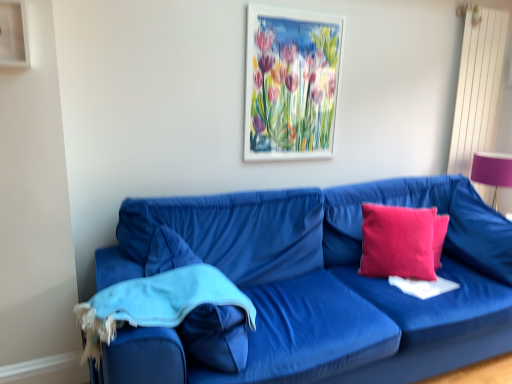
Describe the element at coordinates (423, 286) in the screenshot. This screenshot has height=384, width=512. I see `white fabric at center` at that location.

The height and width of the screenshot is (384, 512). In order to click on velvet blue couch at lower left in this screenshot , I will do `click(358, 304)`.

At what (x,y) coordinates should I click in order to perform the action: click on pink fabric pillow at right, placed as the 1th pillow when sorted from right to left. Please return your answer as a coordinate pair (x, y). Looking at the image, I should click on (478, 232).

The image size is (512, 384). I want to click on blue cotton blanket at lower left, so click(156, 303).

Describe the element at coordinates (291, 83) in the screenshot. I see `white matte picture frame at upper center` at that location.

In order to click on white fabric at center in this screenshot , I will do `click(423, 286)`.

Looking at this image, what's the angular difference between velvet blue couch at lower left and pink velvet pillow at right, which ranks as the first pillow in left-to-right order,'s facing directions?

They differ by 27.7 degrees in their facing directions.

Between velvet blue couch at lower left and pink velvet pillow at right, which ranks as the first pillow in left-to-right order, which one has smaller size?

pink velvet pillow at right, which ranks as the first pillow in left-to-right order, is smaller.

Which is in front, point (276, 375) or point (420, 220)?

The point (276, 375) is closer.

From the picture: Is velvet blue couch at lower left surrounding pink velvet pillow at right, marked as the second pillow in a right-to-left arrangement?

Yes, pink velvet pillow at right, marked as the second pillow in a right-to-left arrangement, is surrounded by velvet blue couch at lower left.

Which is in front, blue cotton blanket at lower left or pink velvet pillow at right, which ranks as the first pillow in left-to-right order?

blue cotton blanket at lower left is closer to the camera.

From a real-world perspective, is blue cotton blanket at lower left positioned above or below pink velvet pillow at right, which ranks as the first pillow in left-to-right order?

Clearly, from a real-world perspective, blue cotton blanket at lower left is below pink velvet pillow at right, which ranks as the first pillow in left-to-right order.

Find the location of a particular element. This screenshot has height=384, width=512. material on the left of pink velvet pillow at right, marked as the second pillow in a right-to-left arrangement is located at coordinates (156, 303).

Which of these two, blue cotton blanket at lower left or pink velvet pillow at right, which ranks as the first pillow in left-to-right order, stands taller?

pink velvet pillow at right, which ranks as the first pillow in left-to-right order, is taller.

Would you consider blue cotton blanket at lower left to be distant from white matte picture frame at upper center?

blue cotton blanket at lower left is positioned a significant distance from white matte picture frame at upper center.

From the picture: Can you confirm if blue cotton blanket at lower left is smaller than white matte picture frame at upper center?

No, blue cotton blanket at lower left is not smaller than white matte picture frame at upper center.

Between point (83, 327) and point (312, 22), which one is positioned behind?

The point (312, 22) is farther from the camera.

Where is `picture frame that appears on the right of blue cotton blanket at lower left`? The image size is (512, 384). picture frame that appears on the right of blue cotton blanket at lower left is located at coordinates (291, 83).

Is velvet blue couch at lower left directly adjacent to blue cotton blanket at lower left?

No, velvet blue couch at lower left is not beside blue cotton blanket at lower left.

Locate an element on the screen. studio couch below the blue cotton blanket at lower left (from a real-world perspective) is located at coordinates (358, 304).

Is velvet blue couch at lower left oriented away from blue cotton blanket at lower left?

No, velvet blue couch at lower left's orientation is not away from blue cotton blanket at lower left.

Is pink velvet pillow at right, marked as the second pillow in a right-to-left arrangement, to the right of pink fabric pillow at right, which is counted as the second pillow, starting from the left, from the viewer's perspective?

No, pink velvet pillow at right, marked as the second pillow in a right-to-left arrangement, is not to the right of pink fabric pillow at right, which is counted as the second pillow, starting from the left.

Is pink velvet pillow at right, which ranks as the first pillow in left-to-right order, outside of pink fabric pillow at right, placed as the 1th pillow when sorted from right to left?

pink velvet pillow at right, which ranks as the first pillow in left-to-right order, is positioned outside pink fabric pillow at right, placed as the 1th pillow when sorted from right to left.

Consider the image. Could you measure the distance between pink velvet pillow at right, marked as the second pillow in a right-to-left arrangement, and pink fabric pillow at right, placed as the 1th pillow when sorted from right to left?

pink velvet pillow at right, marked as the second pillow in a right-to-left arrangement, and pink fabric pillow at right, placed as the 1th pillow when sorted from right to left, are 38.12 centimeters apart from each other.

Is pink velvet pillow at right, marked as the second pillow in a right-to-left arrangement, in front of pink fabric pillow at right, placed as the 1th pillow when sorted from right to left?

No, the depth of pink velvet pillow at right, marked as the second pillow in a right-to-left arrangement, is greater than that of pink fabric pillow at right, placed as the 1th pillow when sorted from right to left.

Who is shorter, pink fabric pillow at right, which is counted as the second pillow, starting from the left, or blue cotton blanket at lower left?

Standing shorter between the two is blue cotton blanket at lower left.

From a real-world perspective, between pink fabric pillow at right, which is counted as the second pillow, starting from the left, and blue cotton blanket at lower left, who is vertically higher?

pink fabric pillow at right, which is counted as the second pillow, starting from the left, from a real-world perspective.

Is pink fabric pillow at right, which is counted as the second pillow, starting from the left, located outside blue cotton blanket at lower left?

pink fabric pillow at right, which is counted as the second pillow, starting from the left, is positioned outside blue cotton blanket at lower left.

The height and width of the screenshot is (384, 512). I want to click on sheet below the velvet blue couch at lower left (from a real-world perspective), so click(423, 286).

Could you tell me if velvet blue couch at lower left is facing white fabric at center?

Yes, velvet blue couch at lower left is turned towards white fabric at center.

Who is smaller, velvet blue couch at lower left or white fabric at center?

white fabric at center.

Between velvet blue couch at lower left and white fabric at center, which one has less height?

white fabric at center.

The image size is (512, 384). I want to click on the 1st pillow counting from the right side of the velvet blue couch at lower left, so click(x=401, y=241).

From the blue cotton blanket at lower left, count 2nd pillows backward and point to it. Please provide its 2D coordinates.

[(401, 241)]

Considering their positions, is pink velvet pillow at right, which ranks as the first pillow in left-to-right order, positioned further to blue cotton blanket at lower left than white matte picture frame at upper center?

white matte picture frame at upper center lies further to blue cotton blanket at lower left than the other object.

Considering their positions, is blue cotton blanket at lower left positioned further to velvet blue couch at lower left than pink velvet pillow at right, marked as the second pillow in a right-to-left arrangement?

blue cotton blanket at lower left is positioned further to the anchor velvet blue couch at lower left.

When comparing their distances from blue cotton blanket at lower left, does white matte picture frame at upper center or white fabric at center seem closer?

white matte picture frame at upper center is closer to blue cotton blanket at lower left.

Considering their positions, is pink fabric pillow at right, which is counted as the second pillow, starting from the left, positioned further to blue cotton blanket at lower left than white fabric at center?

Based on the image, pink fabric pillow at right, which is counted as the second pillow, starting from the left, appears to be further to blue cotton blanket at lower left.

Looking at this image, when comparing their distances from pink fabric pillow at right, which is counted as the second pillow, starting from the left, does pink fabric lampshade at right or velvet blue couch at lower left seem closer?

velvet blue couch at lower left lies closer to pink fabric pillow at right, which is counted as the second pillow, starting from the left, than the other object.

When comparing their distances from blue cotton blanket at lower left, does white fabric at center or pink fabric lampshade at right seem further?

The object further to blue cotton blanket at lower left is pink fabric lampshade at right.

From the image, which object appears to be farther from pink fabric pillow at right, placed as the 1th pillow when sorted from right to left, blue cotton blanket at lower left or white fabric at center?

Based on the image, blue cotton blanket at lower left appears to be further to pink fabric pillow at right, placed as the 1th pillow when sorted from right to left.

Which object lies further to the anchor point blue cotton blanket at lower left, pink velvet pillow at right, marked as the second pillow in a right-to-left arrangement, or pink fabric pillow at right, placed as the 1th pillow when sorted from right to left?

pink fabric pillow at right, placed as the 1th pillow when sorted from right to left.

Locate an element on the screen. studio couch situated between white matte picture frame at upper center and pink fabric pillow at right, which is counted as the second pillow, starting from the left, from left to right is located at coordinates (358, 304).

This screenshot has width=512, height=384. Find the location of `studio couch between blue cotton blanket at lower left and pink velvet pillow at right, marked as the second pillow in a right-to-left arrangement`. studio couch between blue cotton blanket at lower left and pink velvet pillow at right, marked as the second pillow in a right-to-left arrangement is located at coordinates (358, 304).

The height and width of the screenshot is (384, 512). Identify the location of pillow between white matte picture frame at upper center and pink fabric pillow at right, which is counted as the second pillow, starting from the left, from left to right. (401, 241).

The height and width of the screenshot is (384, 512). Find the location of `sheet between white matte picture frame at upper center and pink fabric lampshade at right in the horizontal direction`. sheet between white matte picture frame at upper center and pink fabric lampshade at right in the horizontal direction is located at coordinates (423, 286).